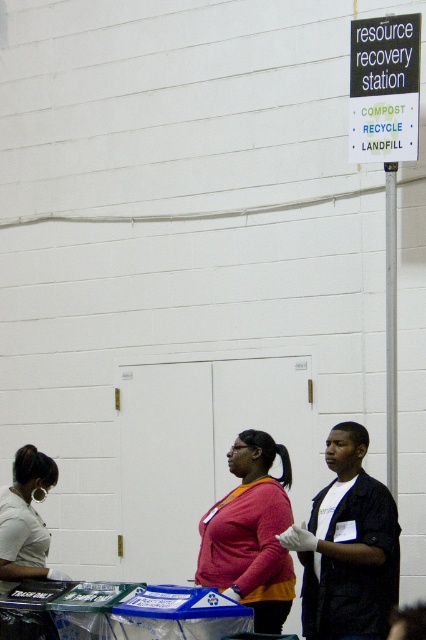
Between black matte shirt at center and black plastic sign at upper right, which one has less height?

With less height is black plastic sign at upper right.

How far apart are black matte shirt at center and black plastic sign at upper right?

A distance of 8.59 feet exists between black matte shirt at center and black plastic sign at upper right.

What do you see at coordinates (348, 547) in the screenshot? This screenshot has height=640, width=426. I see `black matte shirt at center` at bounding box center [348, 547].

Where is `black matte shirt at center`? The width and height of the screenshot is (426, 640). black matte shirt at center is located at coordinates (348, 547).

Is point (250, 468) behind point (36, 516)?

That is False.

Which is behind, point (244, 577) or point (29, 520)?

The point (29, 520) is behind.

Image resolution: width=426 pixels, height=640 pixels. What do you see at coordinates (250, 532) in the screenshot? I see `matte pink sweater at center` at bounding box center [250, 532].

Locate an element on the screen. This screenshot has height=640, width=426. matte pink sweater at center is located at coordinates (250, 532).

Is point (411, 77) positioned before point (11, 506)?

No, (411, 77) is further to viewer.

Is black plastic sign at upper right further to camera compared to matte white shirt at lower left?

Yes, black plastic sign at upper right is behind matte white shirt at lower left.

Does point (383, 93) lie behind point (5, 579)?

Yes, it is.

Find the location of `black plastic sign at upper right`. black plastic sign at upper right is located at coordinates (385, 88).